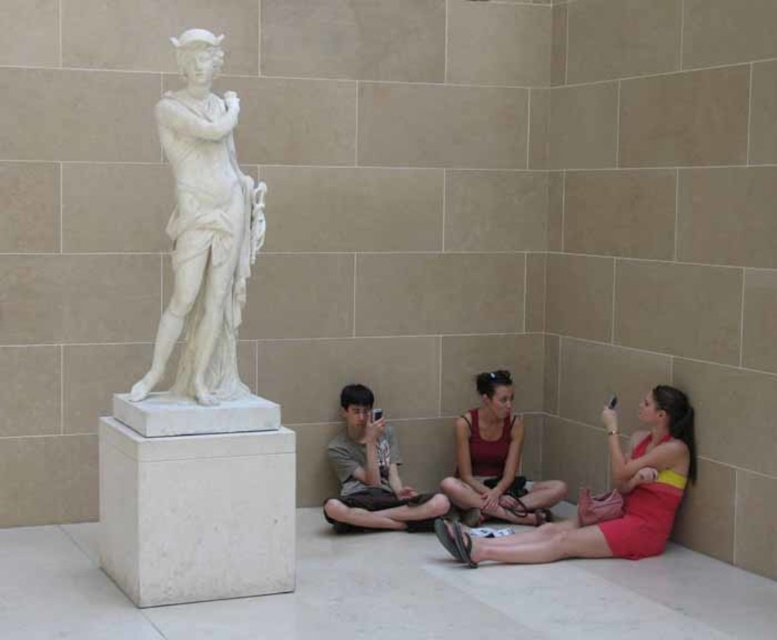
Who is more forward, (514, 416) or (354, 410)?

Positioned in front is point (354, 410).

How far apart are matte red tank top at lower center and gray cotton t-shirt at center?

A distance of 62.74 centimeters exists between matte red tank top at lower center and gray cotton t-shirt at center.

Who is more distant from viewer, (500,476) or (330,518)?

The point (500,476) is more distant.

The width and height of the screenshot is (777, 640). I want to click on matte red tank top at lower center, so click(x=495, y=460).

Can you confirm if white marble statue at center is smaller than matte red dress at lower right?

Incorrect, white marble statue at center is not smaller in size than matte red dress at lower right.

This screenshot has height=640, width=777. What do you see at coordinates (199, 385) in the screenshot?
I see `white marble statue at center` at bounding box center [199, 385].

Image resolution: width=777 pixels, height=640 pixels. What are the coordinates of `white marble statue at center` in the screenshot? It's located at (199, 385).

Describe the element at coordinates (194, 499) in the screenshot. I see `white marble pedestal at center` at that location.

Does white marble pedestal at center have a smaller size compared to matte red dress at lower right?

Yes, white marble pedestal at center is smaller than matte red dress at lower right.

Which is in front, point (237, 424) or point (683, 444)?

Point (237, 424) is more forward.

Find the location of a particular element. white marble pedestal at center is located at coordinates (194, 499).